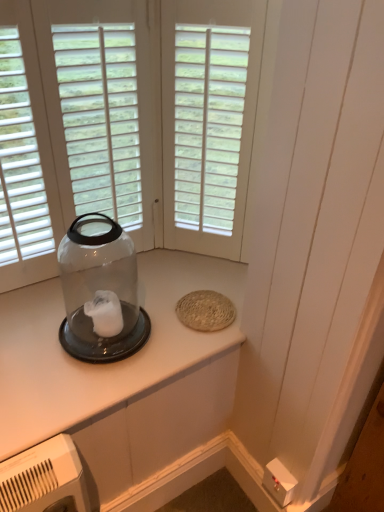
Question: Is transparent glass jar at left at the right side of clear plastic jar at upper left?

Choices:
 (A) yes
 (B) no

Answer: (B)

Question: Is transparent glass jar at left thinner than clear plastic jar at upper left?

Choices:
 (A) yes
 (B) no

Answer: (A)

Question: Are transparent glass jar at left and clear plastic jar at upper left beside each other?

Choices:
 (A) yes
 (B) no

Answer: (B)

Question: Is the position of transparent glass jar at left more distant than that of clear plastic jar at upper left?

Choices:
 (A) no
 (B) yes

Answer: (A)

Question: Is transparent glass jar at left closer to camera compared to clear plastic jar at upper left?

Choices:
 (A) yes
 (B) no

Answer: (A)

Question: Considering the positions of clear plastic jar at upper left and white matte window at center in the image, is clear plastic jar at upper left taller or shorter than white matte window at center?

Choices:
 (A) tall
 (B) short

Answer: (B)

Question: Is clear plastic jar at upper left situated inside white matte window at center or outside?

Choices:
 (A) inside
 (B) outside

Answer: (B)

Question: In the image, is clear plastic jar at upper left positioned in front of or behind white matte window at center?

Choices:
 (A) front
 (B) behind

Answer: (A)

Question: From a real-world perspective, is clear plastic jar at upper left positioned above or below white matte window at center?

Choices:
 (A) below
 (B) above

Answer: (A)

Question: From a real-world perspective, is white matte window at center positioned above or below transparent glass jar at left?

Choices:
 (A) above
 (B) below

Answer: (A)

Question: In the image, is white matte window at center positioned in front of or behind transparent glass jar at left?

Choices:
 (A) behind
 (B) front

Answer: (A)

Question: Is white matte window at center inside or outside of transparent glass jar at left?

Choices:
 (A) inside
 (B) outside

Answer: (B)

Question: Based on their sizes in the image, would you say white matte window at center is bigger or smaller than transparent glass jar at left?

Choices:
 (A) big
 (B) small

Answer: (B)

Question: Visually, is clear plastic jar at upper left positioned to the left or to the right of transparent glass jar at left?

Choices:
 (A) right
 (B) left

Answer: (A)

Question: Relative to transparent glass jar at left, is clear plastic jar at upper left in front or behind?

Choices:
 (A) behind
 (B) front

Answer: (A)